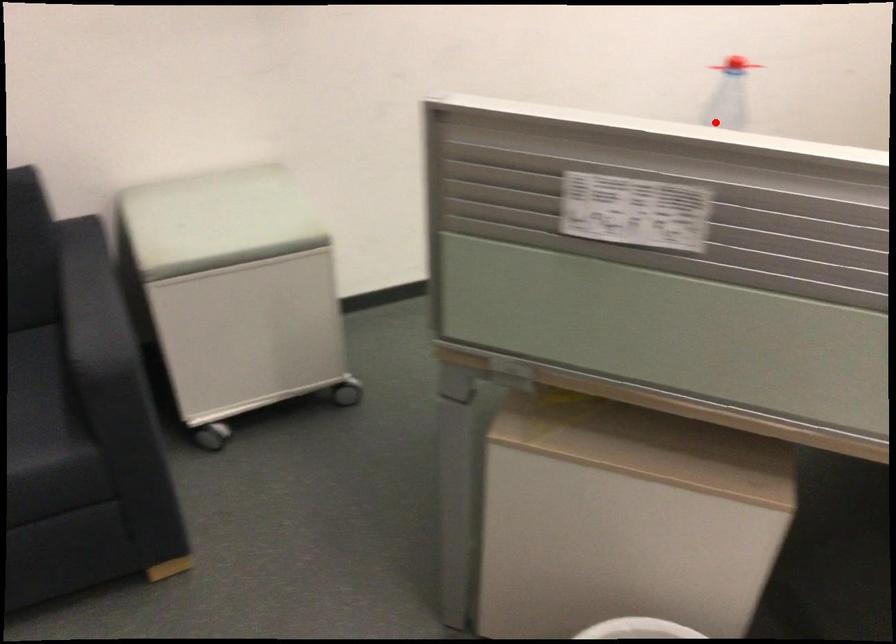
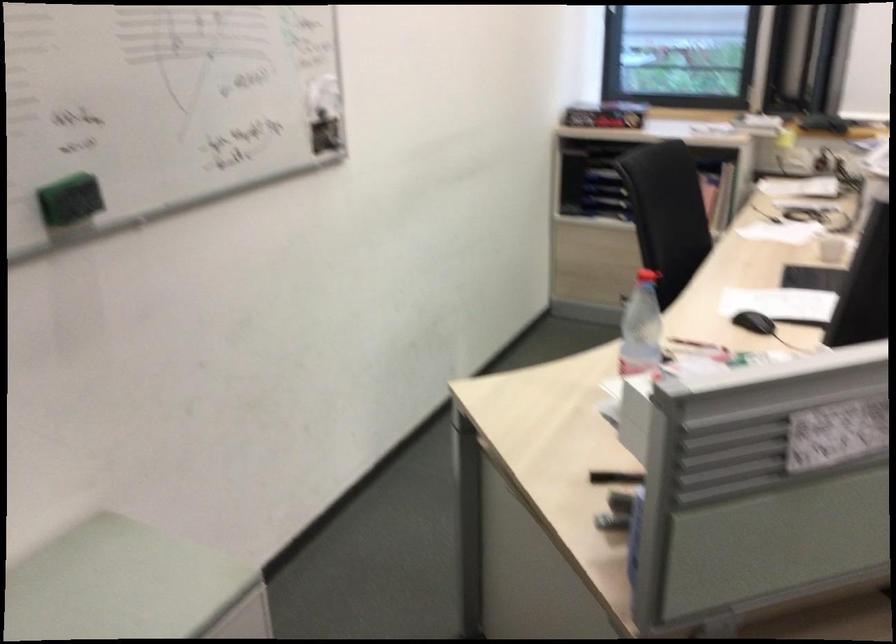
Question: I am providing you with two images of the same scene from different viewpoints. Image1 has a red point marked. In image2, the corresponding 3D location appears at what relative position? Reply with the corresponding letter.

Choices:
 (A) Closer
 (B) Farther

Answer: (B)